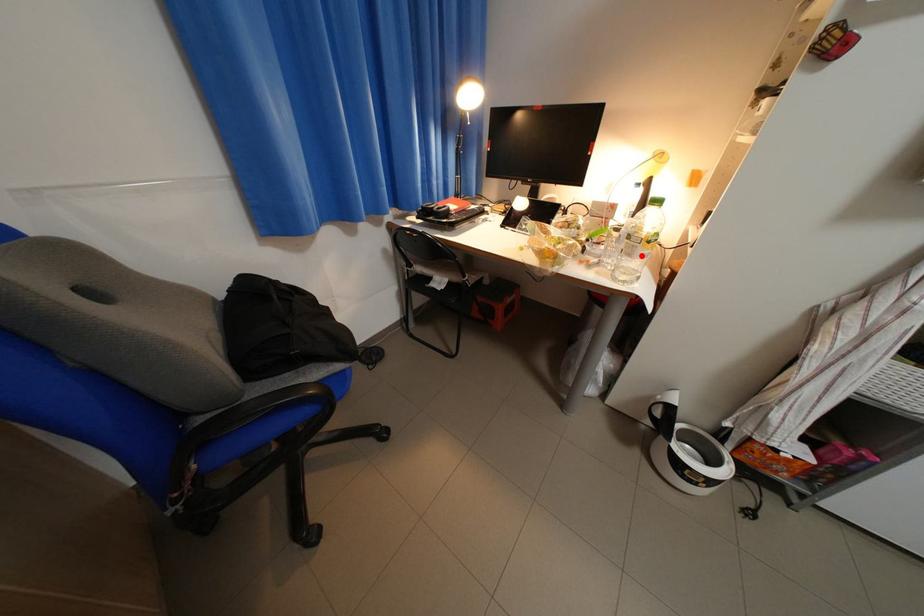
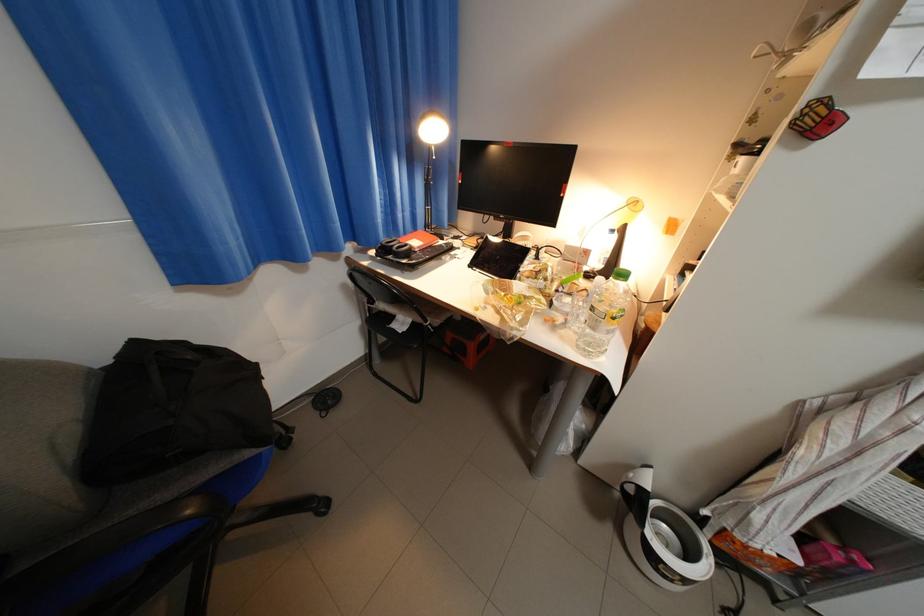
Locate, in the second image, the point that corresponds to the highlighted location in the first image.

(605, 330)